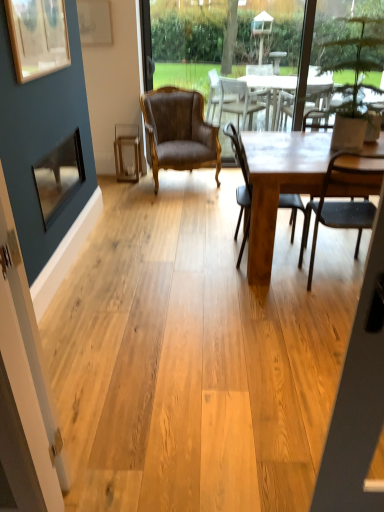
Identify the location of vacant space in between wooden table at center and transparent glass screen door at left. (225, 339).